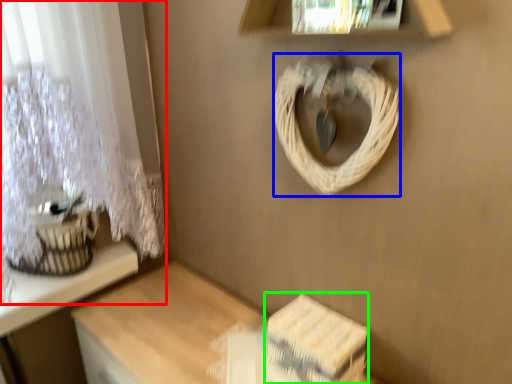
Question: Which object is the closest to the curtain (highlighted by a red box)? Choose among these: rope (highlighted by a blue box) or storage box (highlighted by a green box).

Choices:
 (A) rope
 (B) storage box

Answer: (A)